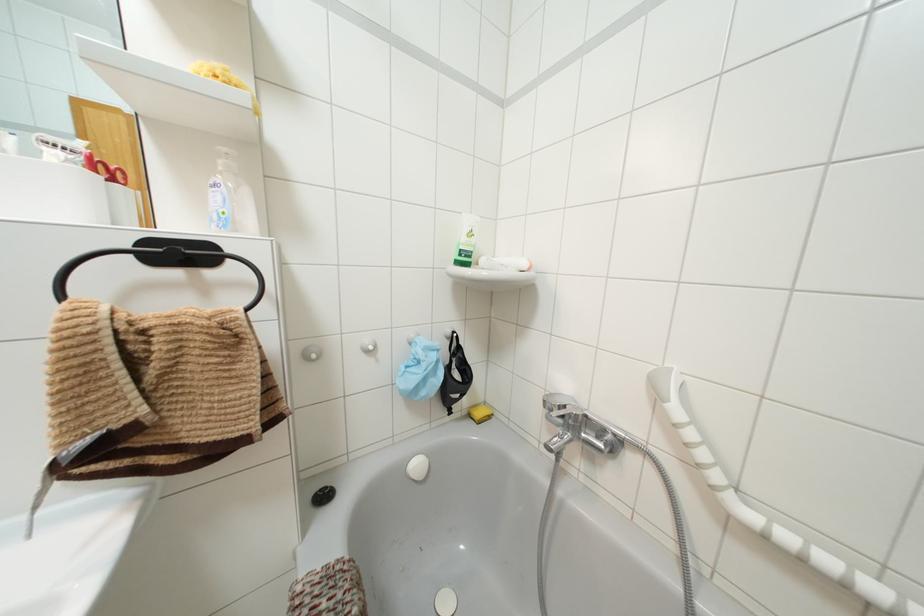
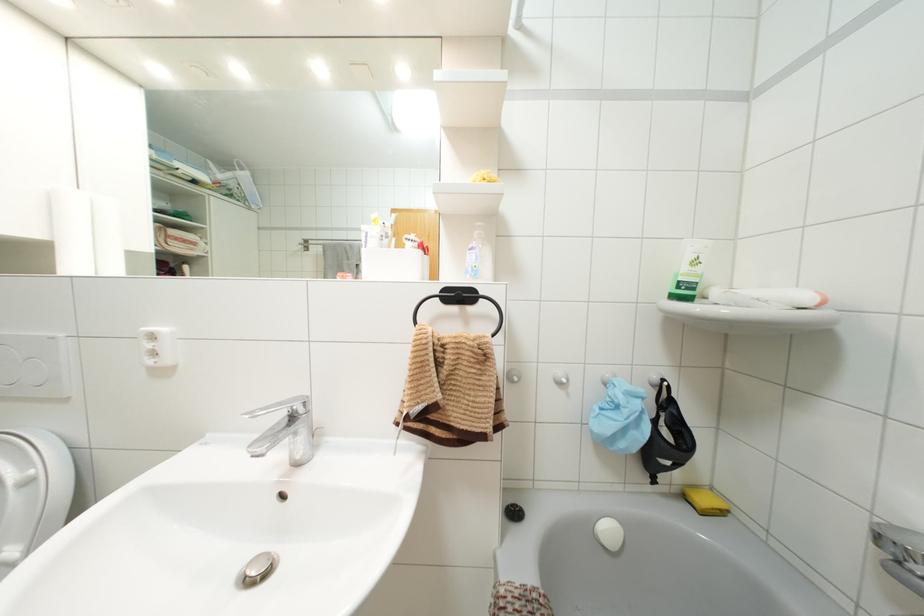
In the second image, find the point that corresponds to the point at 469,233 in the first image.

(695, 262)